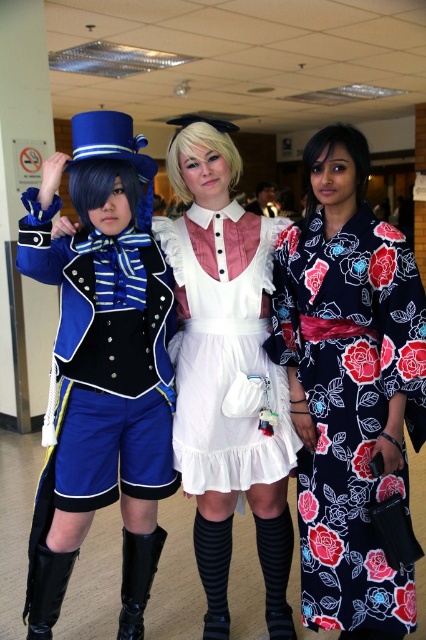
Question: Among these objects, which one is nearest to the camera?

Choices:
 (A) floral silk kimono at right
 (B) white satin dress at center
 (C) matte blue uniform at left
 (D) black leather boot at lower left

Answer: (C)

Question: Which of the following is the closest to the observer?

Choices:
 (A) (65, 589)
 (B) (227, 362)

Answer: (B)

Question: Is black leather boot at lower center in front of black leather boot at lower left?

Choices:
 (A) no
 (B) yes

Answer: (A)

Question: Does floral silk kimono at right have a lesser width compared to black leather boot at lower left?

Choices:
 (A) no
 (B) yes

Answer: (A)

Question: Where is matte blue uniform at left located in relation to black leather boot at lower left in the image?

Choices:
 (A) right
 (B) left

Answer: (A)

Question: Which of the following is the farthest from the observer?

Choices:
 (A) black leather boot at lower left
 (B) floral silk kimono at right
 (C) matte blue uniform at left
 (D) white satin dress at center

Answer: (D)